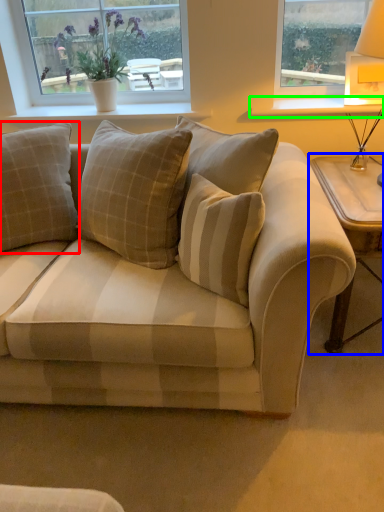
Question: Which is farther away from pillow (highlighted by a red box)? table (highlighted by a blue box) or window sill (highlighted by a green box)?

Choices:
 (A) table
 (B) window sill

Answer: (A)